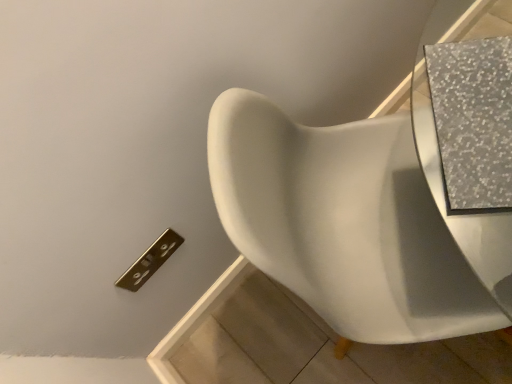
Find the location of a particular element. Image resolution: width=512 pixels, height=384 pixels. white glossy toilet at center is located at coordinates (343, 222).

The width and height of the screenshot is (512, 384). What do you see at coordinates (343, 222) in the screenshot? I see `white glossy toilet at center` at bounding box center [343, 222].

Identify the location of white glossy toilet at center. (343, 222).